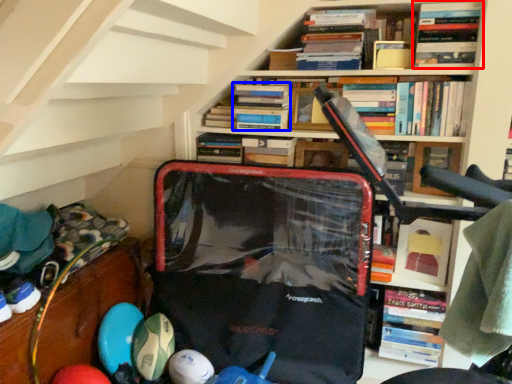
Question: Which object is closer to the camera taking this photo, book (highlighted by a red box) or book (highlighted by a blue box)?

Choices:
 (A) book
 (B) book

Answer: (A)